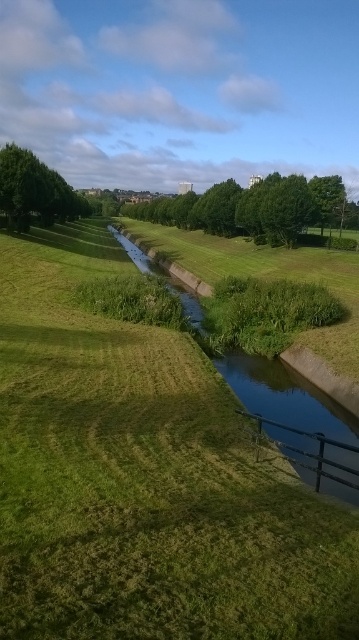
You are a gardener who needs to mow the lawn. You see the green grassy at center and the green grassy stream at center. Which area requires mowing first based on their height?

The green grassy at center is not as tall as green grassy stream at center, so the green grassy stream at center requires mowing first because it is taller and needs attention before it grows too long.

From the picture: You are a gardener planning to plant a new flower bed between the green grassy at center and the green leafy tree at center. Based on their positions, where should you place the flower bed so it is between both objects?

The green grassy at center is below the green leafy tree at center, so you should place the flower bed between them by positioning it under the tree, above the grassy area.